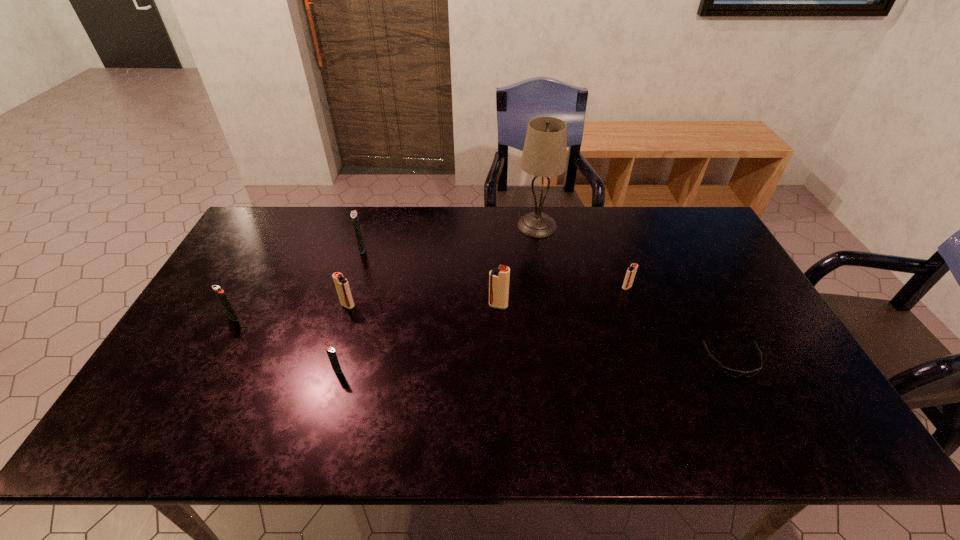
The height and width of the screenshot is (540, 960). In order to click on vacant position located on the back of the leftmost black igniter in this screenshot , I will do `click(262, 265)`.

At what (x,y) coordinates should I click in order to perform the action: click on vacant region located on the right of the second smallest red igniter. Please return your answer as a coordinate pair (x, y). This screenshot has width=960, height=540. Looking at the image, I should click on (493, 305).

The width and height of the screenshot is (960, 540). I want to click on free region located on the front of the farthest red igniter, so click(x=659, y=379).

This screenshot has height=540, width=960. Find the location of `vacant point located on the front of the nearest black igniter`. vacant point located on the front of the nearest black igniter is located at coordinates (325, 413).

You are a GUI agent. You are given a task and a screenshot of the screen. Output one action in this format:
    pyautogui.click(x=<x>, y=<y>)
    Task: Click on the free spot located 0.150m on the front-facing side of the rightmost object
    The width and height of the screenshot is (960, 540).
    Given the screenshot: What is the action you would take?
    pyautogui.click(x=772, y=435)

You are a GUI agent. You are given a task and a screenshot of the screen. Output one action in this format:
    pyautogui.click(x=<x>, y=<y>)
    Task: Click on the lampshade situated at the far edge
    The height and width of the screenshot is (540, 960).
    Given the screenshot: What is the action you would take?
    pyautogui.click(x=544, y=154)

At what (x,y) coordinates should I click in order to perform the action: click on igniter that is at the far edge. Please return your answer as a coordinate pair (x, y). The image size is (960, 540). Looking at the image, I should click on (354, 216).

What are the coordinates of `object positioned at the left edge` in the screenshot? It's located at (220, 293).

Find the location of `object present at the right edge`. object present at the right edge is located at coordinates (735, 373).

The height and width of the screenshot is (540, 960). What are the coordinates of `free space at the far edge of the desktop` in the screenshot? It's located at (308, 221).